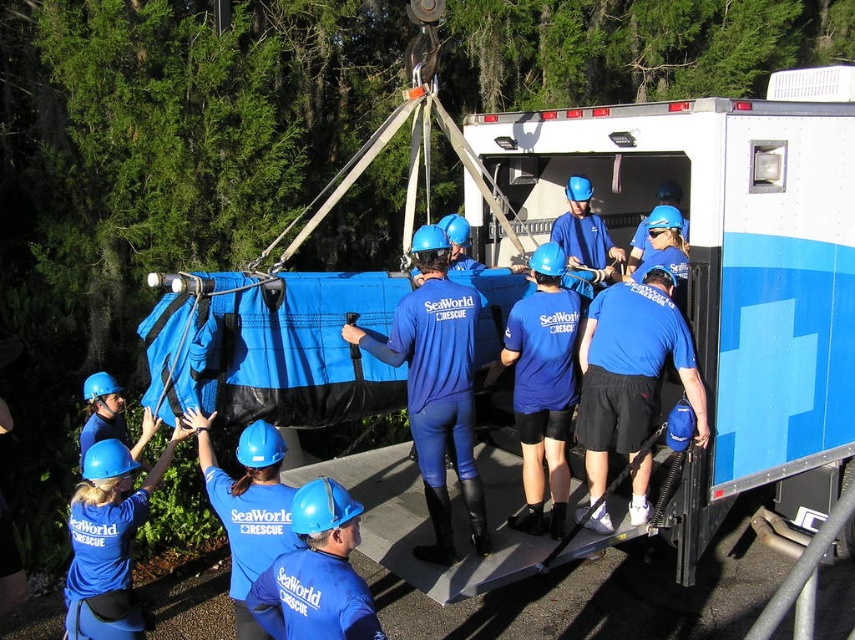
Can you confirm if matte blue wetsuit at center is positioned above blue matte shorts at center?

Correct, matte blue wetsuit at center is located above blue matte shorts at center.

Between matte blue wetsuit at center and blue matte shorts at center, which one has more height?

matte blue wetsuit at center is taller.

Is point (411, 332) positioned in front of point (646, 284)?

Yes.

This screenshot has height=640, width=855. I want to click on matte blue wetsuit at center, so click(x=435, y=387).

Where is `blue matte shorts at center`? This screenshot has width=855, height=640. blue matte shorts at center is located at coordinates (631, 371).

Who is more forward, [608,387] or [282,625]?

Point [282,625] is more forward.

At what (x,y) coordinates should I click in order to perform the action: click on blue matte shorts at center. Please return your answer as a coordinate pair (x, y). The width and height of the screenshot is (855, 640). Looking at the image, I should click on (631, 371).

Can you confirm if blue matte shorts at center is shorter than matte blue helmet at upper left?

Incorrect, blue matte shorts at center's height does not fall short of matte blue helmet at upper left's.

Which of these two, blue matte shorts at center or matte blue helmet at upper left, stands taller?

Standing taller between the two is blue matte shorts at center.

Find the location of a particular element. The width and height of the screenshot is (855, 640). blue matte shorts at center is located at coordinates (631, 371).